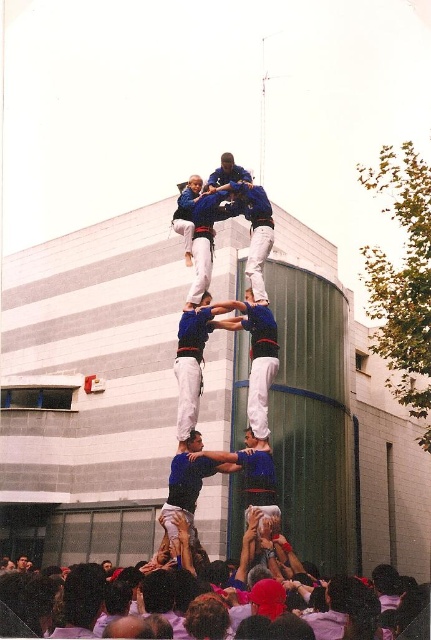
Describe the element at coordinates (187, 492) in the screenshot. Image resolution: width=431 pixels, height=640 pixels. I see `blue fabric person at center` at that location.

Where is `blue fabric person at center`? Image resolution: width=431 pixels, height=640 pixels. blue fabric person at center is located at coordinates (187, 492).

Between white cotton shirt at lower center and blue fabric person at center, which one appears on the right side from the viewer's perspective?

From the viewer's perspective, white cotton shirt at lower center appears more on the right side.

Does white cotton shirt at lower center appear under blue fabric person at center?

Correct, white cotton shirt at lower center is located below blue fabric person at center.

The height and width of the screenshot is (640, 431). What do you see at coordinates (84, 600) in the screenshot?
I see `white cotton shirt at lower center` at bounding box center [84, 600].

Locate an element on the screen. white cotton shirt at lower center is located at coordinates (84, 600).

Does white cotton shirt at lower center have a lesser width compared to blue fabric pants at center?

In fact, white cotton shirt at lower center might be wider than blue fabric pants at center.

Describe the element at coordinates (84, 600) in the screenshot. Image resolution: width=431 pixels, height=640 pixels. I see `white cotton shirt at lower center` at that location.

Where is `white cotton shirt at lower center`? The width and height of the screenshot is (431, 640). white cotton shirt at lower center is located at coordinates (84, 600).